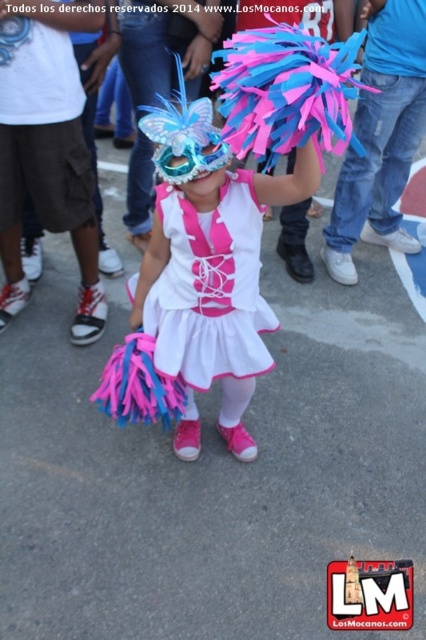
Consider the image. Who is more distant from viewer, (215, 209) or (48, 160)?

The point (48, 160) is behind.

Is point (273, 326) more distant than point (11, 35)?

Yes.

What are the coordinates of `matte plastic mask at center` in the screenshot? It's located at (199, 282).

Who is shorter, matte plastic mask at center or white satin dress at center?

With less height is white satin dress at center.

Between matte plastic mask at center and white satin dress at center, which one has more height?

matte plastic mask at center is taller.

Between point (198, 237) and point (204, 292), which one is positioned in front?

Point (198, 237) is more forward.

I want to click on matte plastic mask at center, so click(199, 282).

Measure the distance between pink satin ballet skirt at center and white satin dress at center.

pink satin ballet skirt at center and white satin dress at center are 35.94 inches apart.

What do you see at coordinates (46, 148) in the screenshot?
I see `pink satin ballet skirt at center` at bounding box center [46, 148].

Who is more distant from viewer, (48,188) or (195,236)?

The point (48,188) is behind.

The image size is (426, 640). In order to click on pink satin ballet skirt at center in this screenshot , I will do `click(46, 148)`.